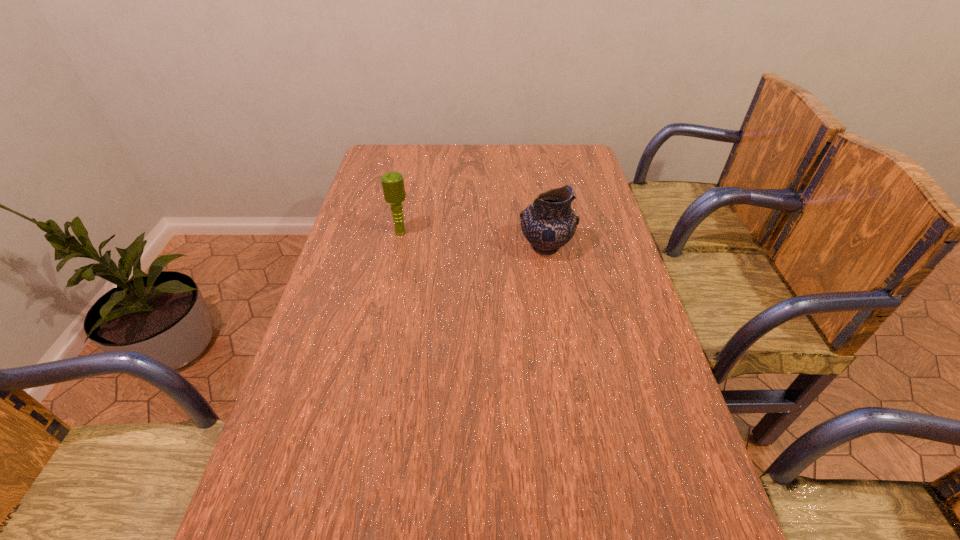
This screenshot has width=960, height=540. I want to click on vacant region at the far right corner, so click(x=549, y=149).

I want to click on vacant space that's between the left object and the pottery, so click(473, 240).

The width and height of the screenshot is (960, 540). I want to click on free space that is in between the left object and the right object, so click(x=473, y=240).

What are the coordinates of `free space between the left object and the pottery` in the screenshot? It's located at (473, 240).

Identify the location of vacant space in between the left object and the pottery. The height and width of the screenshot is (540, 960). (473, 240).

Find the location of `vacant region that satisfies the following two spatial constraints: 1. on the front side of the pottery; 2. on the left side of the microphone`. vacant region that satisfies the following two spatial constraints: 1. on the front side of the pottery; 2. on the left side of the microphone is located at coordinates (398, 247).